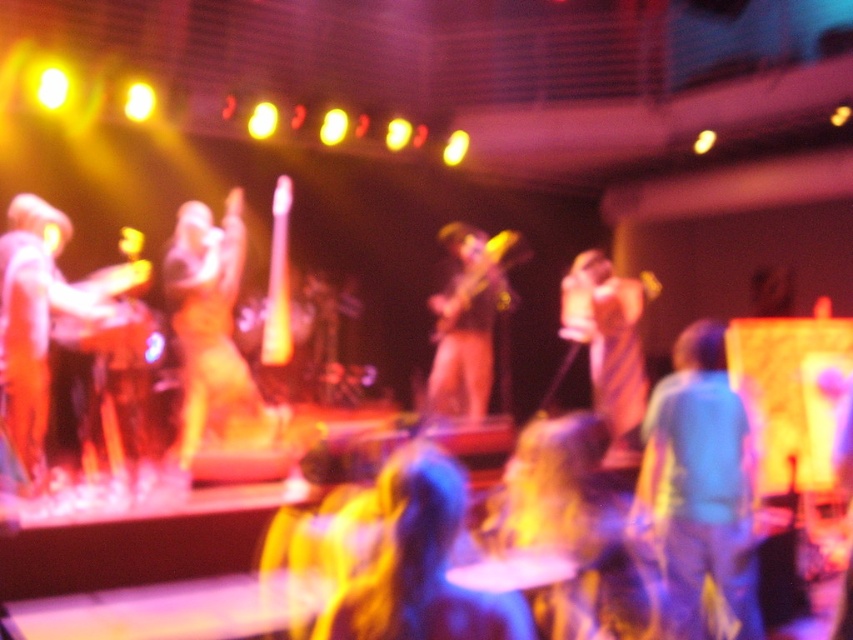
Identify the location of shiny gold guitar at center. The height and width of the screenshot is (640, 853). (466, 321).

This screenshot has height=640, width=853. Describe the element at coordinates (466, 321) in the screenshot. I see `shiny gold guitar at center` at that location.

Where is `shiny gold guitar at center`? The width and height of the screenshot is (853, 640). shiny gold guitar at center is located at coordinates (466, 321).

Is point (427, 480) closer to viewer compared to point (64, 307)?

Yes, point (427, 480) is in front of point (64, 307).

Locate an element on the screen. This screenshot has width=853, height=640. shiny blue hair at center is located at coordinates (418, 563).

The width and height of the screenshot is (853, 640). I want to click on blue fabric shirt at center, so click(700, 483).

Which is behind, point (733, 538) or point (624, 458)?

The point (624, 458) is behind.

Locate an element on the screen. blue fabric shirt at center is located at coordinates (700, 483).